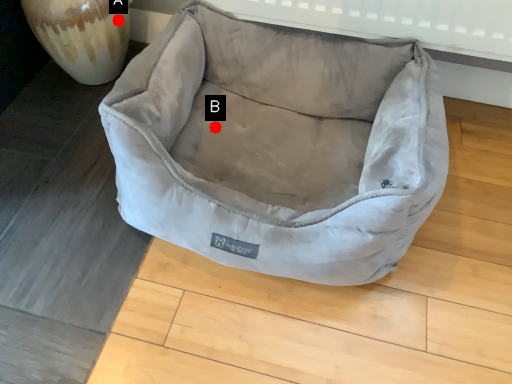
Question: Two points are circled on the image, labeled by A and B beside each circle. Among these points, which one is nearest to the camera?

Choices:
 (A) A is closer
 (B) B is closer

Answer: (B)